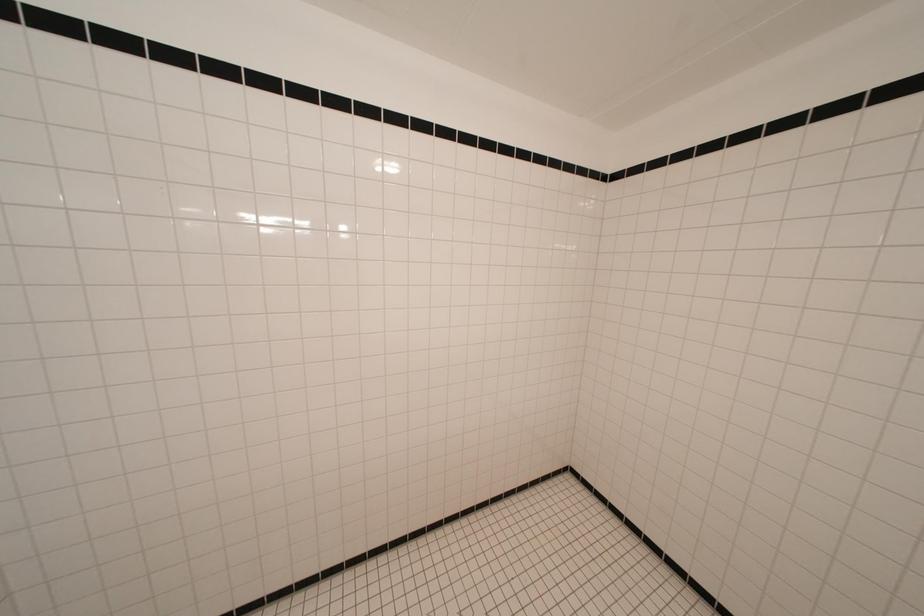
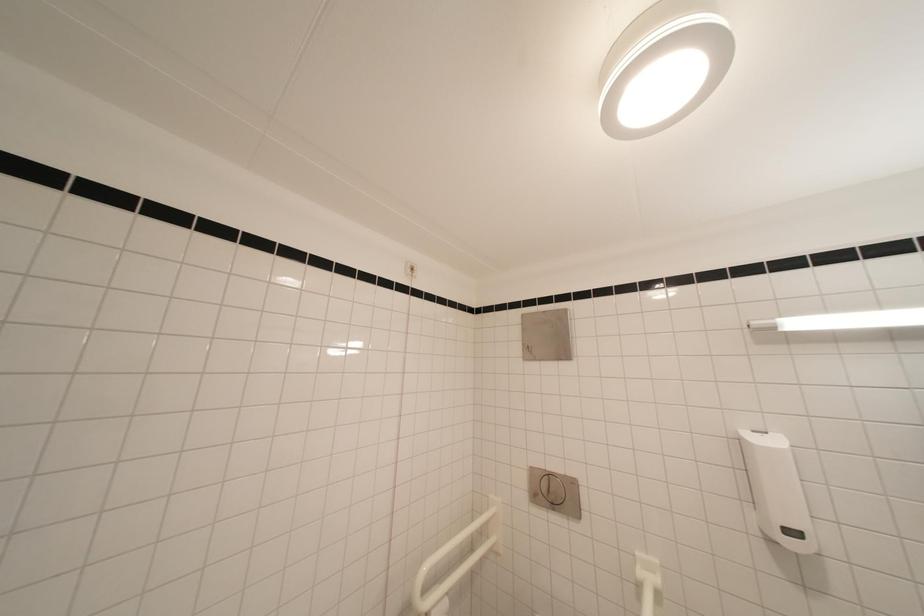
Question: The camera is either moving clockwise (left) or counter-clockwise (right) around the object. The first image is from the beginning of the video and the second image is from the end. Is the camera moving left or right when shooting the video?

Choices:
 (A) Left
 (B) Right

Answer: (A)